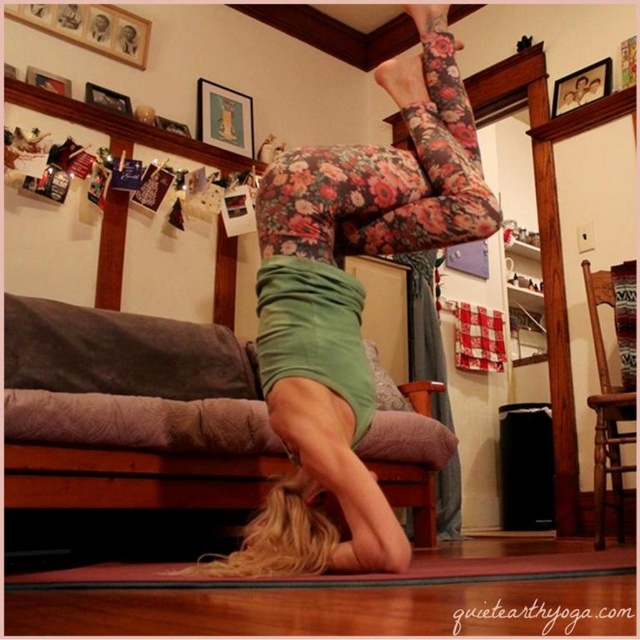
You are a photographer trying to capture the yoga pose. The camera is focused on the floral leggings at center. If you want to adjust the focus to the sofa with a gray blanket and pink cushion in the background, which direction should you move the focus point from the current position?

Since the sofa with a gray blanket and pink cushion is in the background and the floral leggings at center are currently in focus, you should move the focus point upward from the current position at point (x=349, y=307) to capture the sofa in the background.